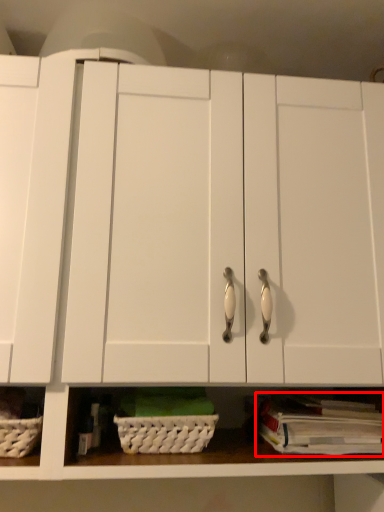
Question: In this image, where is book (annotated by the red box) located relative to basket?

Choices:
 (A) right
 (B) left

Answer: (A)